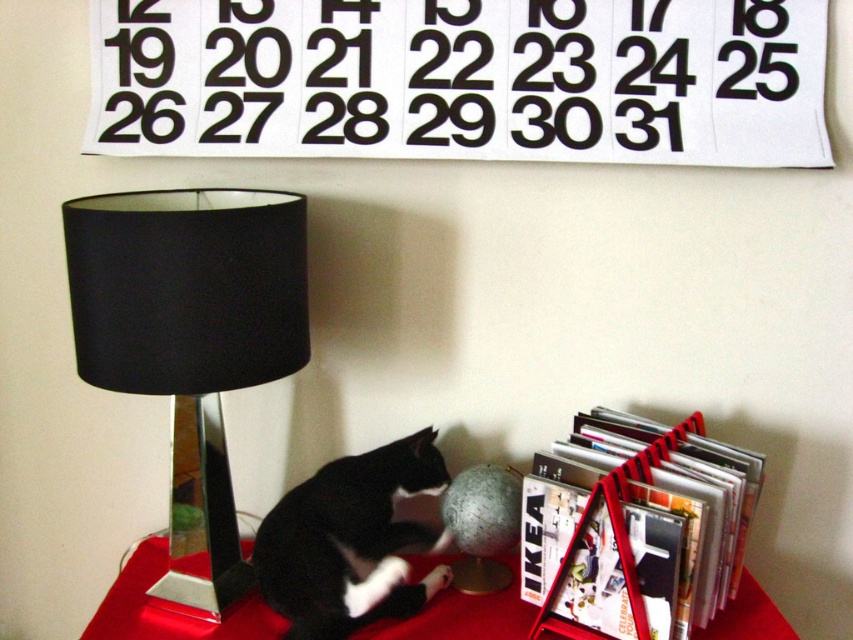
Is white paper calendar at upper center wider than black/white fur cat at center?

Yes.

You are a GUI agent. You are given a task and a screenshot of the screen. Output one action in this format:
    pyautogui.click(x=<x>, y=<y>)
    Task: Click on the white paper calendar at upper center
    This screenshot has width=853, height=640.
    Given the screenshot: What is the action you would take?
    pyautogui.click(x=463, y=80)

Looking at this image, is black/white fur cat at center behind smooth red table at center?

No, it is not.

In the scene shown: Who is positioned more to the left, black/white fur cat at center or smooth red table at center?

Positioned to the left is smooth red table at center.

Is point (323, 611) closer to camera compared to point (148, 577)?

Yes, it is in front of point (148, 577).

Locate an element on the screen. Image resolution: width=853 pixels, height=640 pixels. black/white fur cat at center is located at coordinates pyautogui.click(x=351, y=541).

Which is in front, point (143, 129) or point (186, 372)?

Point (186, 372)

Can you confirm if white paper calendar at upper center is positioned above black fabric lamp at left?

Correct, white paper calendar at upper center is located above black fabric lamp at left.

Between point (788, 8) and point (201, 330), which one is positioned behind?

Positioned behind is point (788, 8).

Image resolution: width=853 pixels, height=640 pixels. I want to click on white paper calendar at upper center, so click(x=463, y=80).